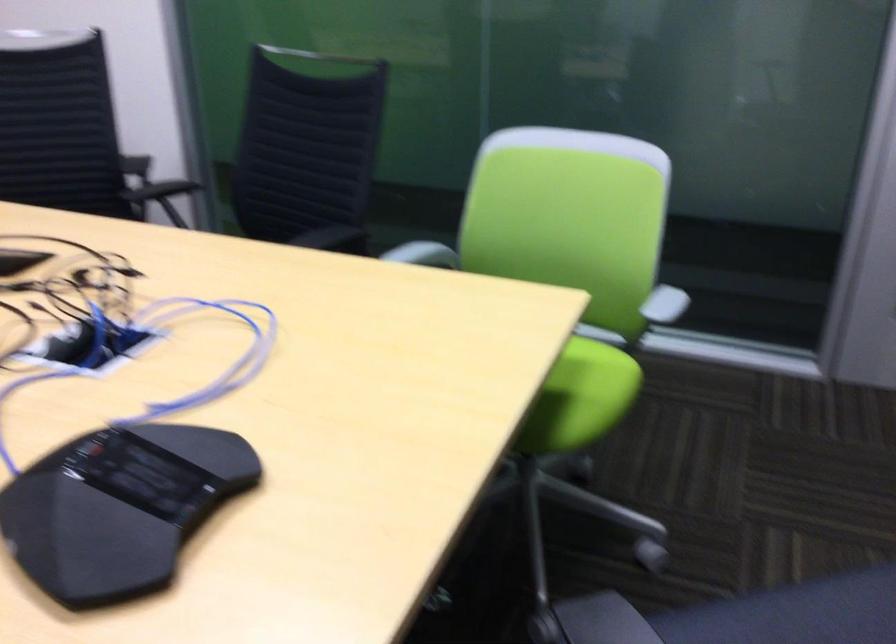
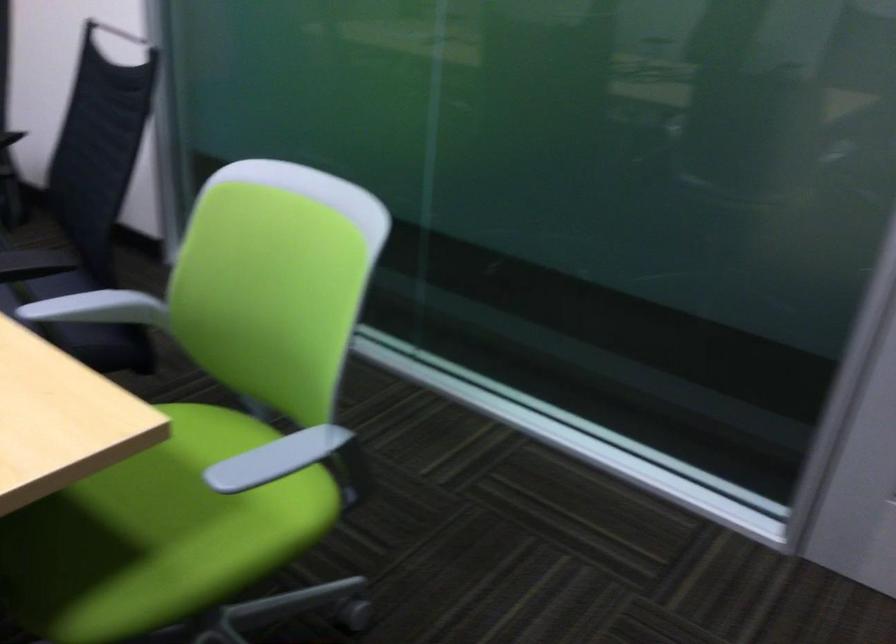
Question: The camera is either moving clockwise (left) or counter-clockwise (right) around the object. The first image is from the beginning of the video and the second image is from the end. Is the camera moving left or right when shooting the video?

Choices:
 (A) Left
 (B) Right

Answer: (B)